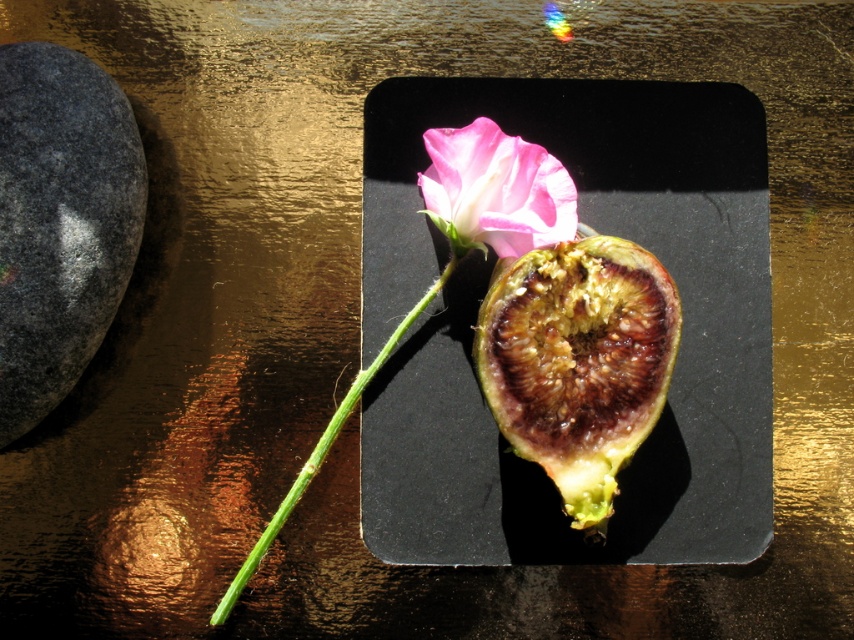
Question: Based on their relative distances, which object is nearer to the green smooth stem at center?

Choices:
 (A) brown fibrous fig at center
 (B) gray granite rock at left
 (C) pink matte flower at center

Answer: (C)

Question: Which point is closer to the camera?

Choices:
 (A) green smooth stem at center
 (B) gray granite rock at left
 (C) brown fibrous fig at center
 (D) pink matte flower at center

Answer: (B)

Question: Can you confirm if brown fibrous fig at center is positioned below green smooth stem at center?

Choices:
 (A) yes
 (B) no

Answer: (B)

Question: Is brown fibrous fig at center positioned at the back of pink matte flower at center?

Choices:
 (A) yes
 (B) no

Answer: (B)

Question: Observing the image, what is the correct spatial positioning of brown fibrous fig at center in reference to green smooth stem at center?

Choices:
 (A) above
 (B) below

Answer: (A)

Question: Which point is closer to the camera taking this photo?

Choices:
 (A) (237, 577)
 (B) (483, 300)

Answer: (A)